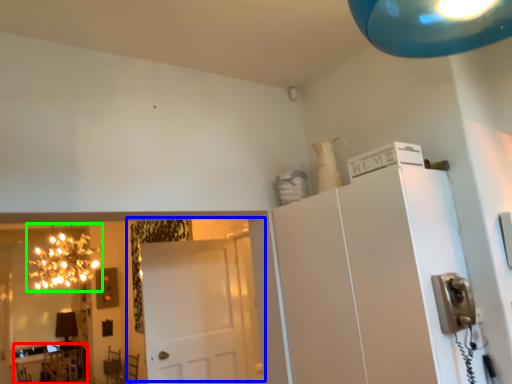
Question: Which object is the closest to the table (highlighted by a red box)? Choose among these: door (highlighted by a blue box) or light fixture (highlighted by a green box).

Choices:
 (A) door
 (B) light fixture

Answer: (B)